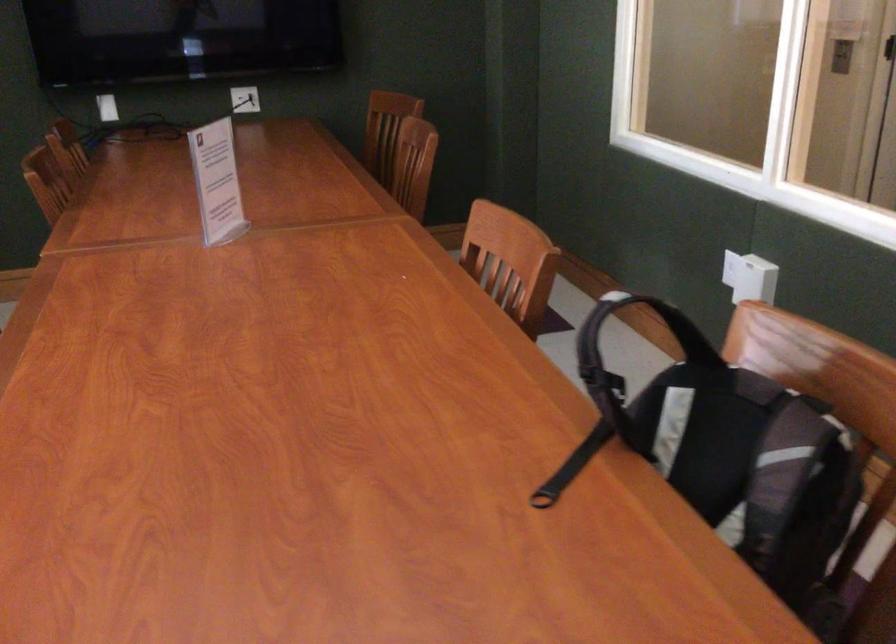
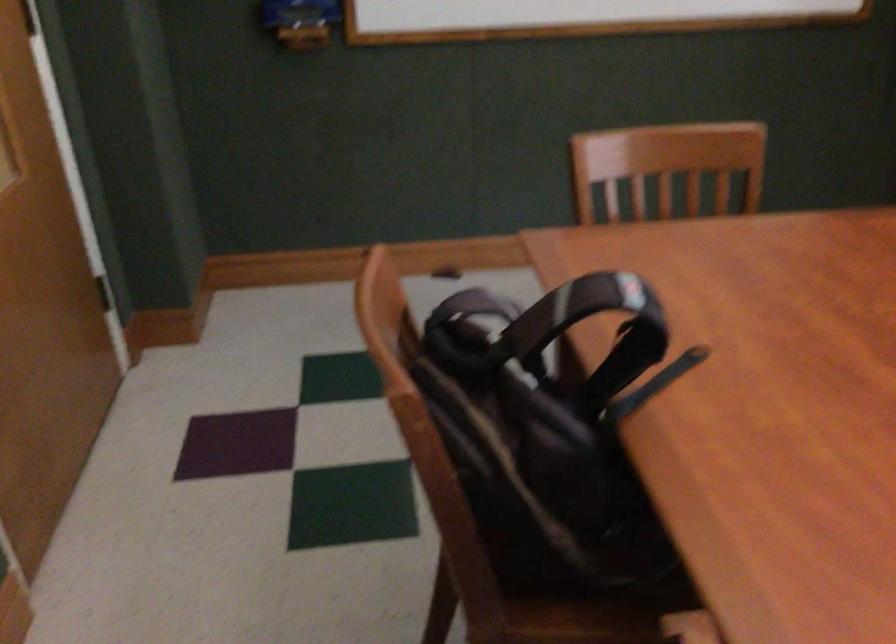
In the second image, find the point that corresponds to the point at 604,295 in the first image.

(625, 297)